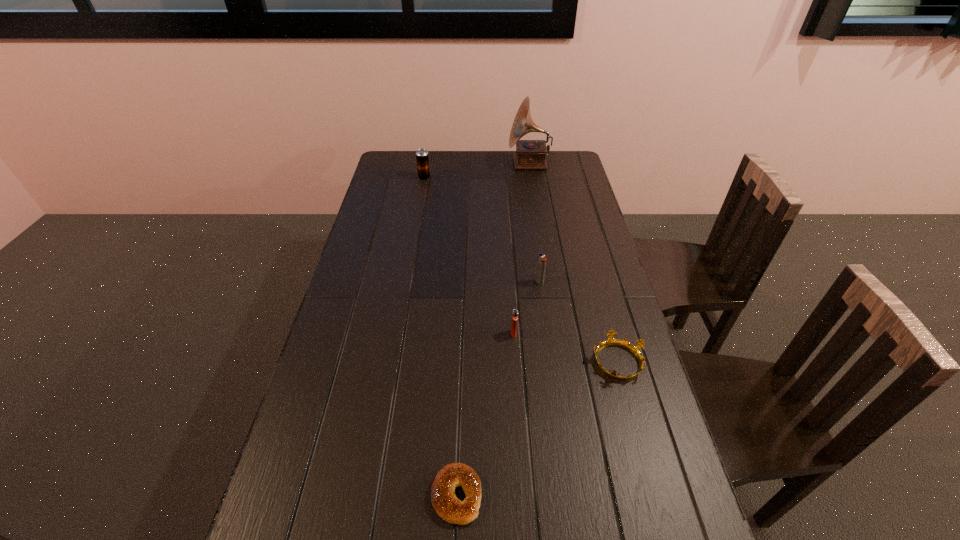
At what (x,y) coordinates should I click in order to perform the action: click on phonograph record that is positioned at the right edge. Please return your answer as a coordinate pair (x, y). This screenshot has width=960, height=540. Looking at the image, I should click on (530, 154).

Locate an element on the screen. crown that is at the right edge is located at coordinates (635, 350).

Where is `object that is positioned at the far right corner`? object that is positioned at the far right corner is located at coordinates (530, 154).

The width and height of the screenshot is (960, 540). Identify the location of free space at the far edge. (462, 157).

Where is `blank area at the left edge`? The image size is (960, 540). blank area at the left edge is located at coordinates (365, 372).

In the image, there is a desktop. Find the location of `free space at the right edge`. free space at the right edge is located at coordinates (629, 526).

At what (x,y) coordinates should I click in order to perform the action: click on vacant space at the far left corner of the desktop. Please return your answer as a coordinate pair (x, y). Image resolution: width=960 pixels, height=540 pixels. Looking at the image, I should click on (396, 165).

This screenshot has height=540, width=960. What are the coordinates of `vacant position at the far right corner of the desktop` in the screenshot? It's located at (573, 161).

You are a GUI agent. You are given a task and a screenshot of the screen. Output one action in this format:
    pyautogui.click(x=<x>, y=<y>)
    Task: Click on the free space between the taller igniter and the fourth tallest object
    This screenshot has height=540, width=960.
    Given the screenshot: What is the action you would take?
    pyautogui.click(x=527, y=308)

Where is `free space between the taller igniter and the crown`? free space between the taller igniter and the crown is located at coordinates (578, 322).